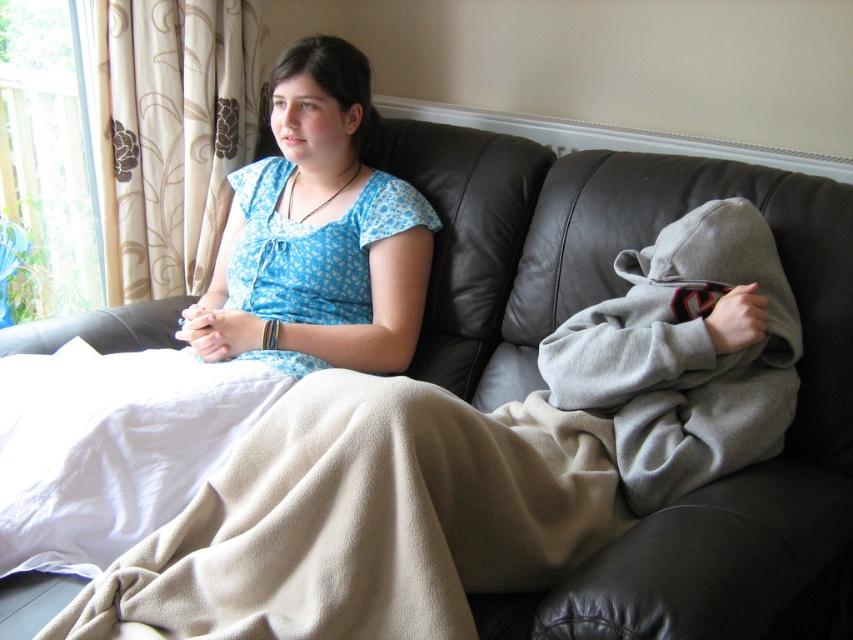
Question: Does blue cotton shirt at upper center appear under beige fleece blanket at lower left?

Choices:
 (A) no
 (B) yes

Answer: (A)

Question: Considering the relative positions of blue printed fabric at center and beige fleece blanket at lower left in the image provided, where is blue printed fabric at center located with respect to beige fleece blanket at lower left?

Choices:
 (A) right
 (B) left

Answer: (A)

Question: Which object is the farthest from the beige fleece blanket at lower left?

Choices:
 (A) blue cotton shirt at upper center
 (B) blue printed fabric at center

Answer: (B)

Question: Which point is closer to the camera?

Choices:
 (A) (3, 506)
 (B) (59, 502)

Answer: (A)

Question: Where is blue cotton shirt at upper center located in relation to blue printed fabric at center in the image?

Choices:
 (A) right
 (B) left

Answer: (B)

Question: Which object is closer to the camera taking this photo?

Choices:
 (A) blue printed fabric at center
 (B) beige fleece blanket at lower left
 (C) blue cotton shirt at upper center

Answer: (B)